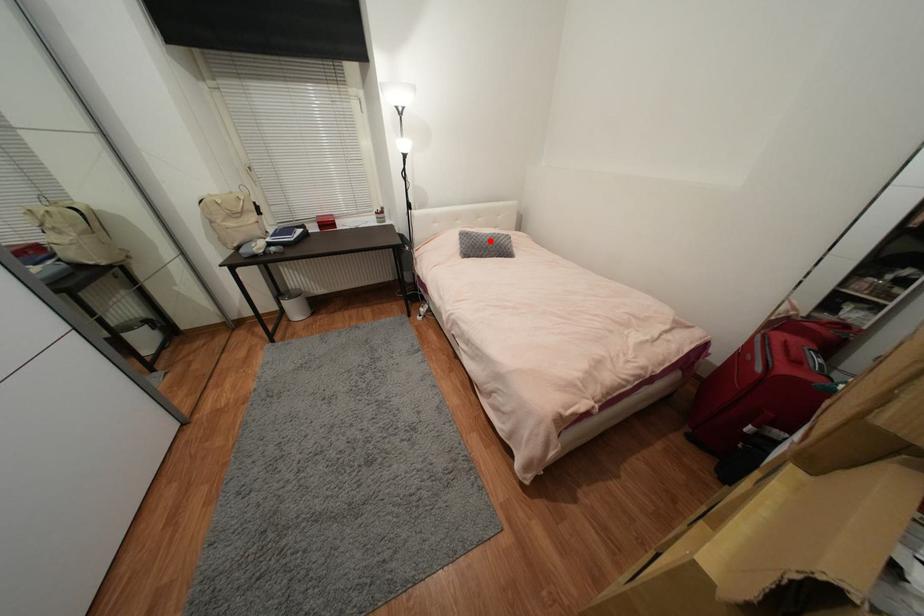
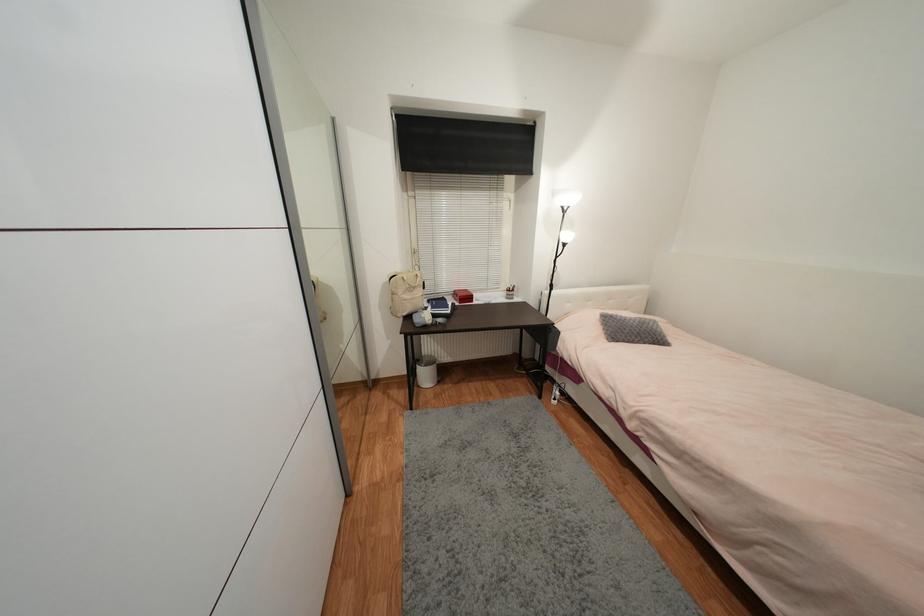
Question: I am providing you with two images of the same scene from different viewpoints. Given a red point in image1, look at the same physical point in image2. Is it:

Choices:
 (A) Closer to the viewpoint
 (B) Farther from the viewpoint

Answer: (B)